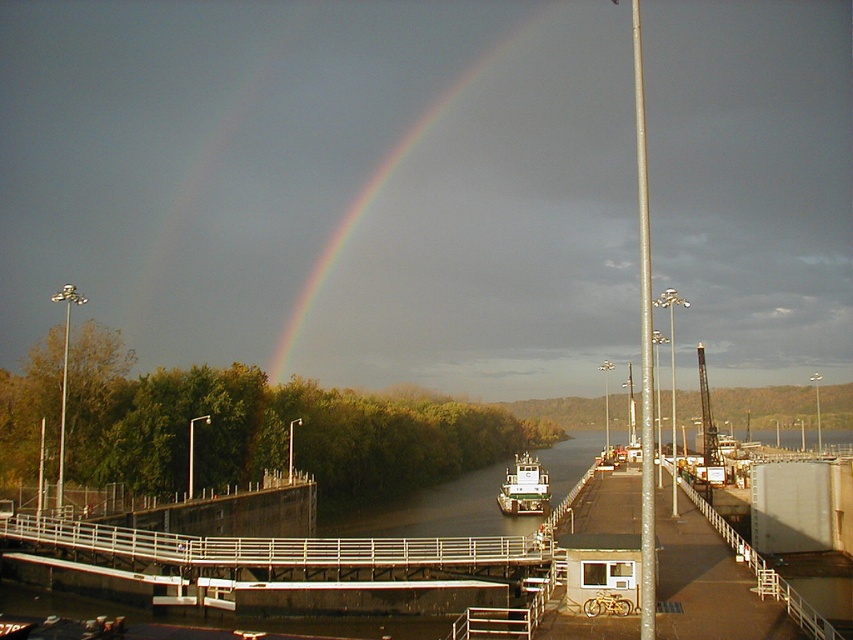
Question: Is rainbow at upper center positioned in front of white matte barge at center?

Choices:
 (A) no
 (B) yes

Answer: (A)

Question: Which object is farther from the camera taking this photo?

Choices:
 (A) white matte barge at center
 (B) rainbow at upper center

Answer: (B)

Question: Can you confirm if rainbow at upper center is positioned to the left of white matte barge at center?

Choices:
 (A) no
 (B) yes

Answer: (B)

Question: Which of the following is the farthest from the observer?

Choices:
 (A) white matte barge at center
 (B) rainbow at upper center

Answer: (B)

Question: Does rainbow at upper center have a larger size compared to white matte barge at center?

Choices:
 (A) no
 (B) yes

Answer: (B)